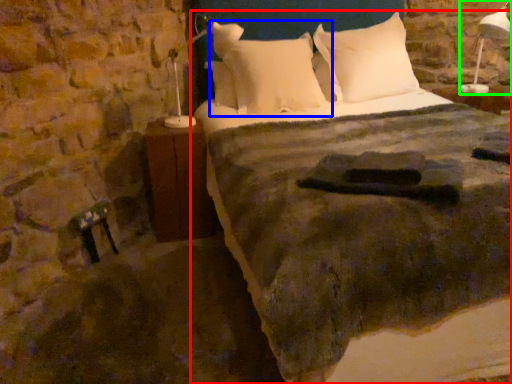
Question: Based on their relative distances, which object is nearer to bed (highlighted by a red box)? Choose from pillow (highlighted by a blue box) and bedside lamp (highlighted by a green box).

Choices:
 (A) pillow
 (B) bedside lamp

Answer: (A)